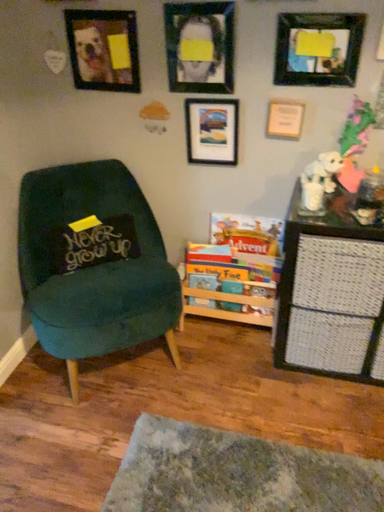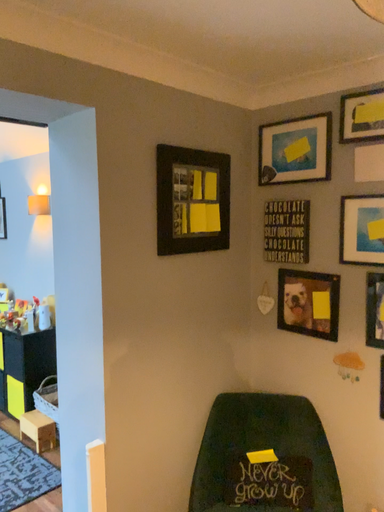
Question: Which way did the camera rotate in the video?

Choices:
 (A) rotated right
 (B) rotated left

Answer: (B)